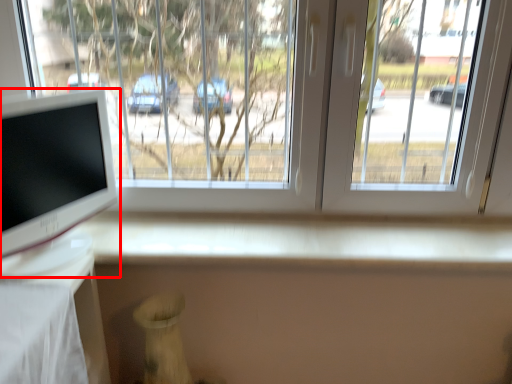
Question: Where is computer monitor (annotated by the red box) located in relation to window in the image?

Choices:
 (A) left
 (B) right

Answer: (A)